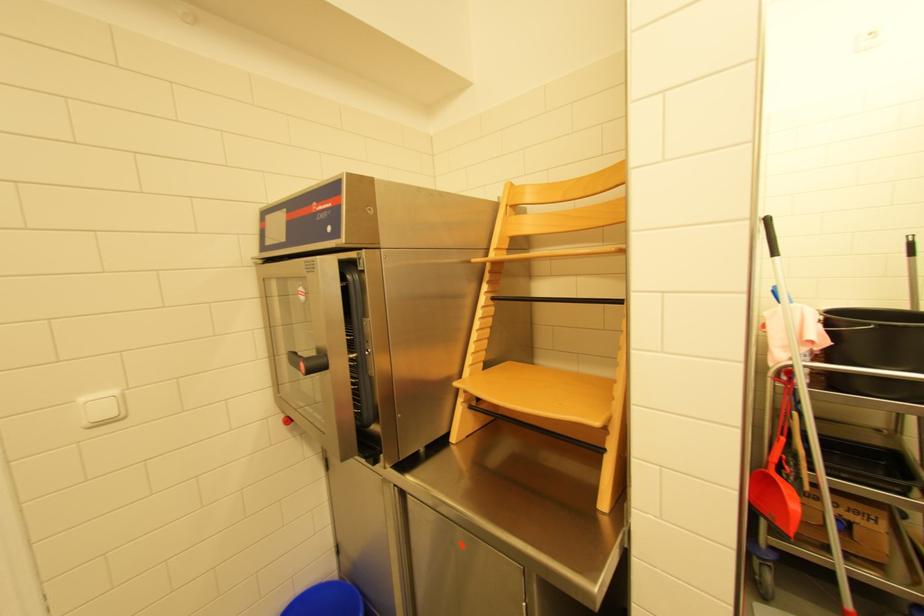
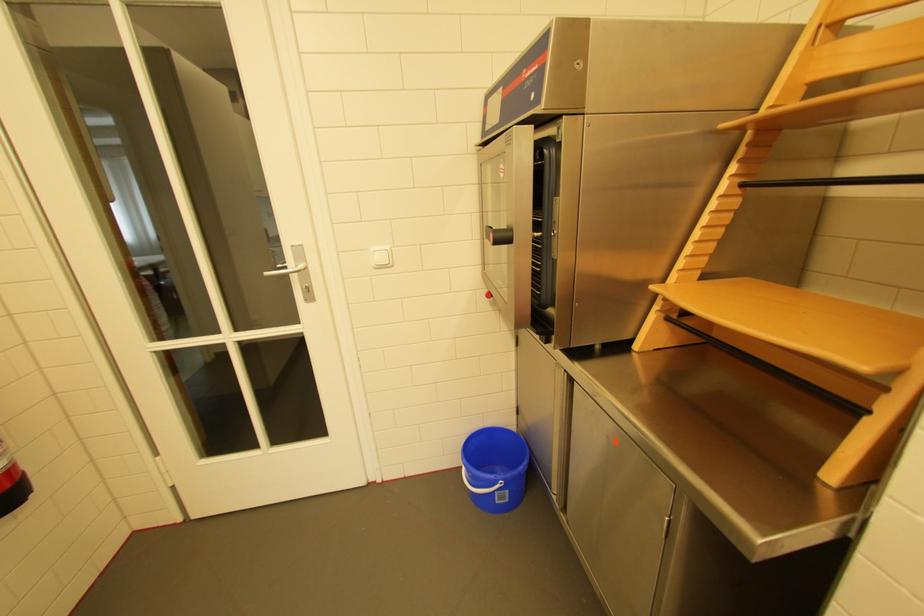
The point at (90, 400) is marked in the first image. Where is the corresponding point in the second image?

(380, 249)